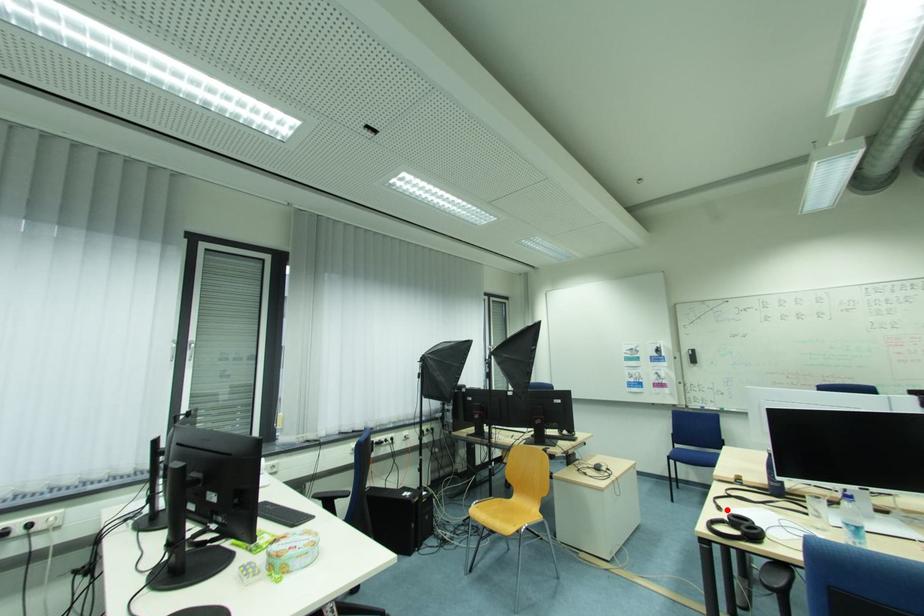
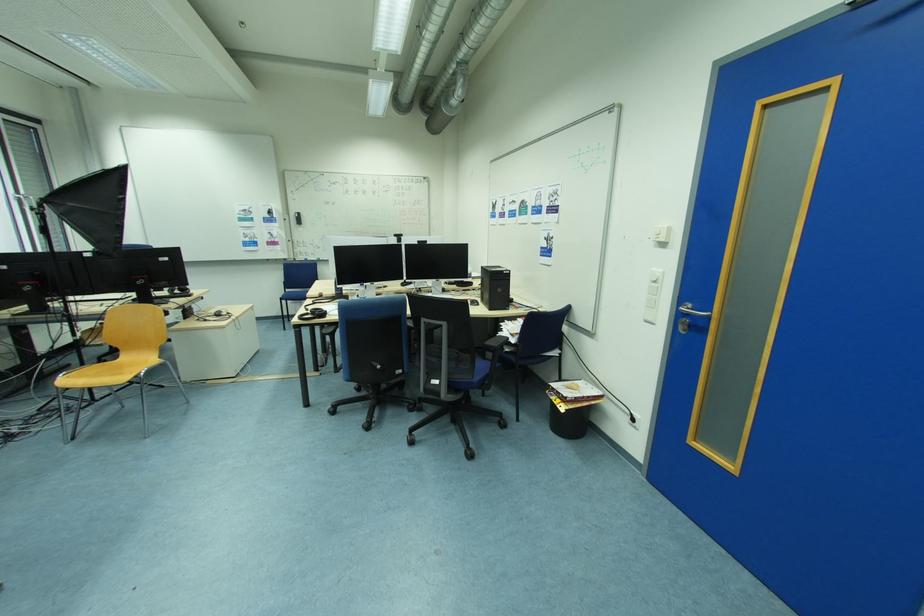
Locate, in the second image, the point that corresponds to the highlighted location in the first image.

(313, 310)